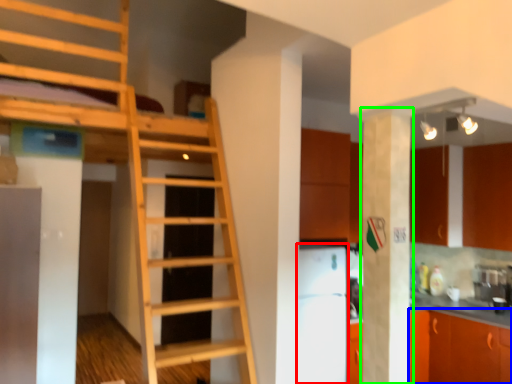
Question: Considering the real-world distances, which object is farthest from appliance (highlighted by a red box)? cabinetry (highlighted by a blue box) or pillar (highlighted by a green box)?

Choices:
 (A) cabinetry
 (B) pillar

Answer: (B)